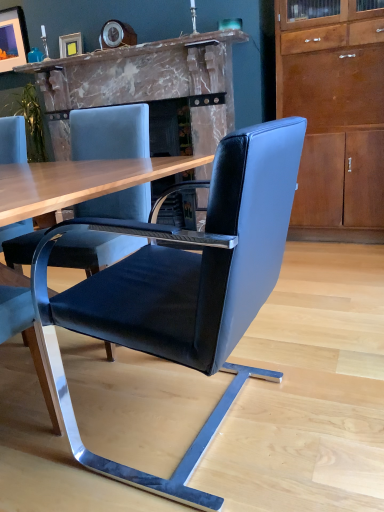
I want to click on unoccupied region to the right of black leather chair at center, so click(x=329, y=392).